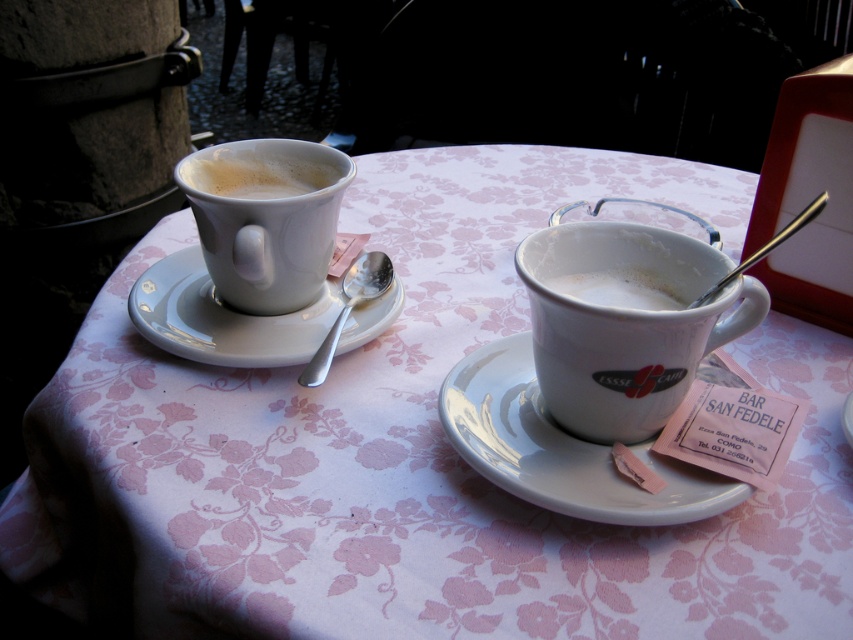
You are a barista holding a camera and want to take a closeup photo of the matte white mug at left. The camera requires a minimum distance of 40 centimeters to focus properly. Can you take the photo without moving the camera closer?

The matte white mug at left and camera are 37.72 centimeters apart, which is less than the required 40 centimeters. Therefore, you cannot take the photo without moving the camera closer to meet the focus distance requirement.

You are a barista preparing coffee for two customers. You have a white glossy mug at center and a white ceramic saucer at center on the table. Which item will you place the coffee grounds into first?

The white glossy mug at center has a lesser width compared to the white ceramic saucer at center, so you should place the coffee grounds into the white glossy mug at center first since it is narrower and designed to hold the beverage.

You are standing in front of the cozy cafe scene described. There is a point at coordinates point (531,332). If you want to place a small decorative item exactly 40 centimeters away from this point towards the viewer, where would you position it relative to the current objects in the scene?

The point at (531,332) is 37.09 centimeters away from the viewer. To place an item 40 centimeters away from this point towards the viewer, you would need to move it 2.91 centimeters closer to the viewer than the current position of point (531,332).